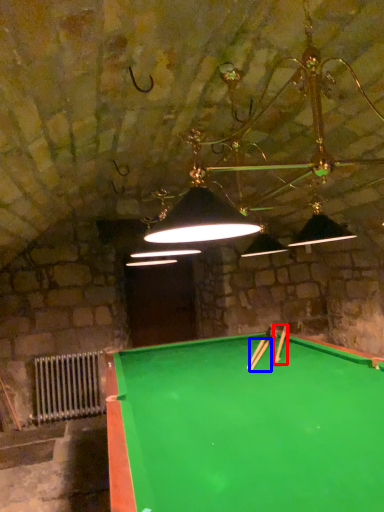
Question: Which of the following is the farthest to the observer, cue (highlighted by a red box) or cue (highlighted by a blue box)?

Choices:
 (A) cue
 (B) cue

Answer: (A)